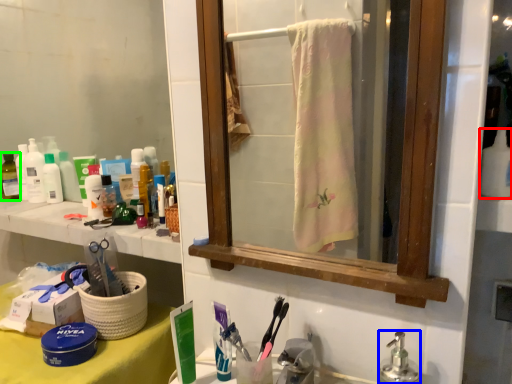
Question: Based on their relative distances, which object is farther from cleaning product (highlighted by a red box)? Choose from soap dispenser (highlighted by a blue box) and toiletry (highlighted by a green box).

Choices:
 (A) soap dispenser
 (B) toiletry

Answer: (B)